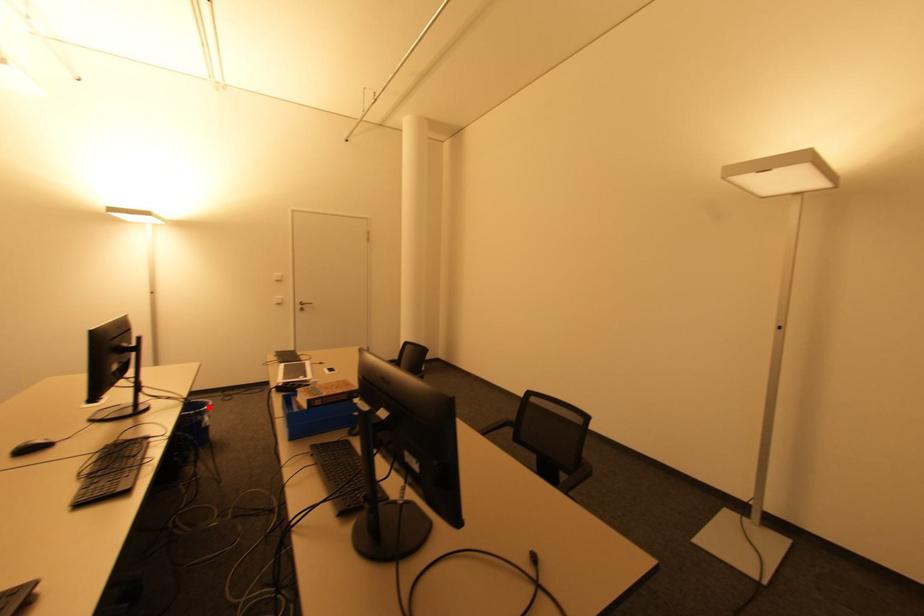
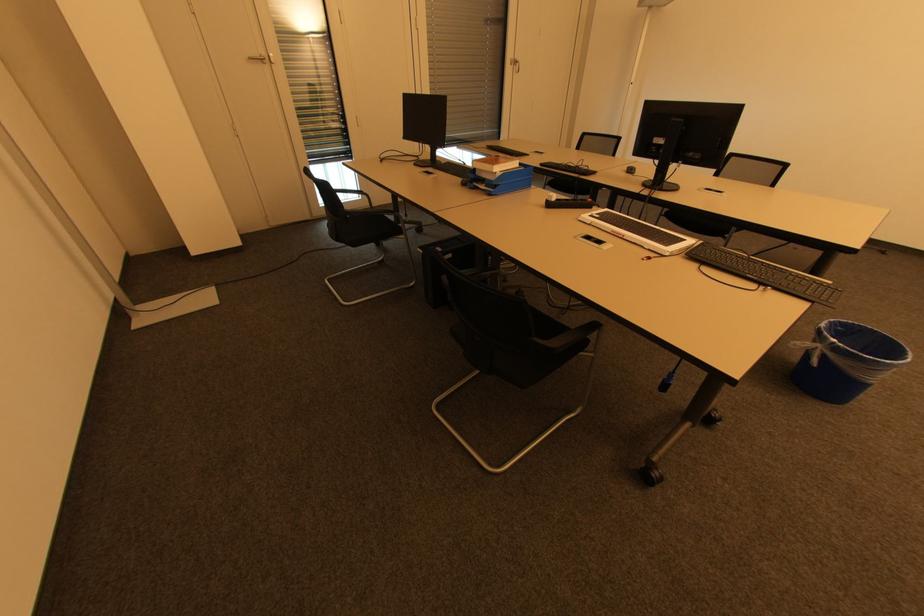
Where in the second image is the point corresponding to the highlighted location from the first image?

(835, 341)